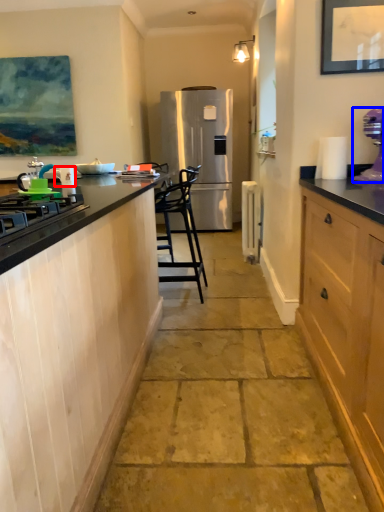
Question: Among these objects, which one is nearest to the camera, appliance (highlighted by a red box) or kitchen appliance (highlighted by a blue box)?

Choices:
 (A) appliance
 (B) kitchen appliance

Answer: (B)